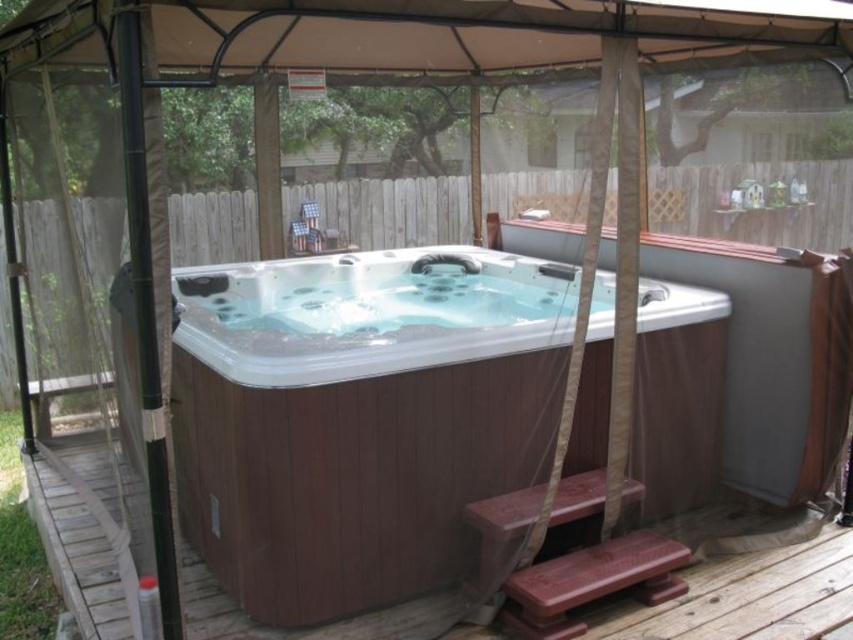
Question: Is brown wood/paneling hot tub at center positioned in front of brown wood deck at lower center?

Choices:
 (A) yes
 (B) no

Answer: (A)

Question: Which point is closer to the camera?

Choices:
 (A) (366, 564)
 (B) (413, 612)

Answer: (A)

Question: Does brown wood/paneling hot tub at center come in front of brown wood deck at lower center?

Choices:
 (A) no
 (B) yes

Answer: (B)

Question: Which of the following is the farthest from the observer?

Choices:
 (A) brown wood/paneling hot tub at center
 (B) brown wood deck at lower center

Answer: (B)

Question: Is brown wood/paneling hot tub at center in front of brown wood deck at lower center?

Choices:
 (A) yes
 (B) no

Answer: (A)